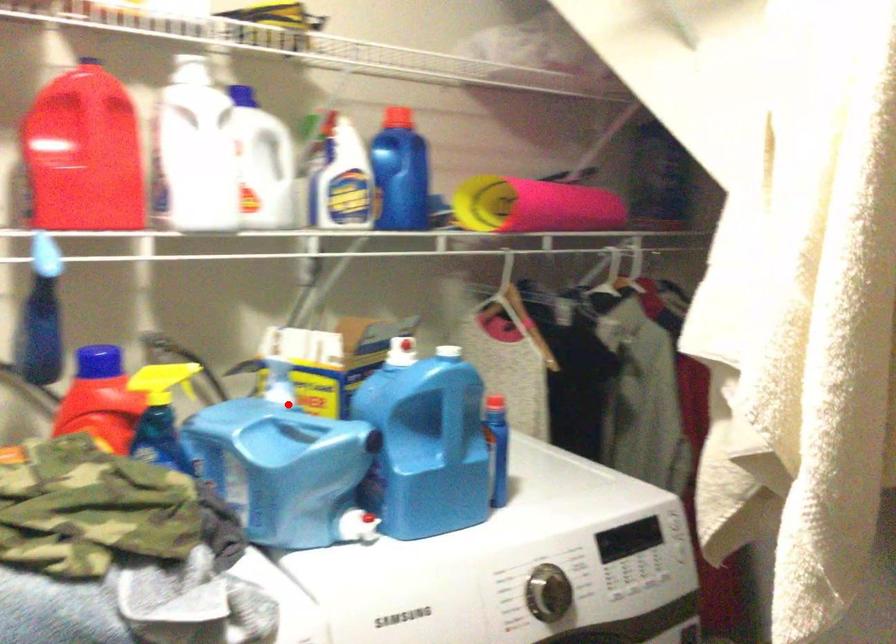
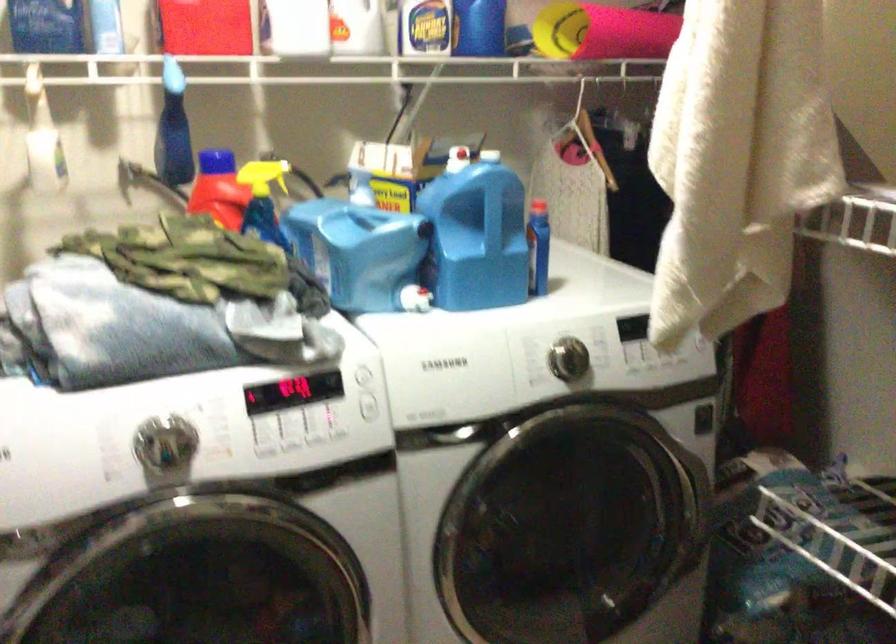
Where in the second image is the point corresponding to the highlighted location from the first image?

(367, 207)